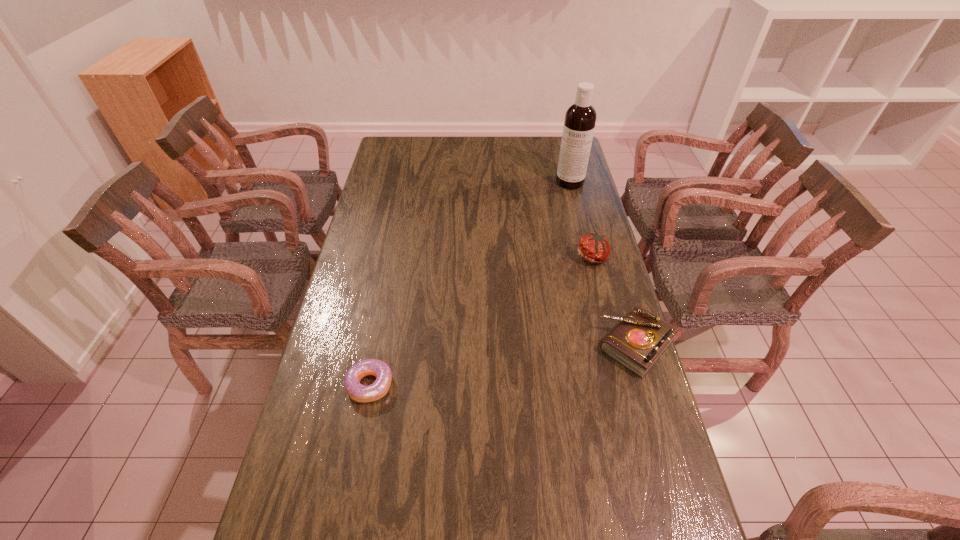
This screenshot has width=960, height=540. Identify the location of free space located 0.150m on the front-facing side of the third shortest object. (558, 289).

This screenshot has height=540, width=960. Find the location of `blank space located 0.300m on the front-facing side of the third shortest object`. blank space located 0.300m on the front-facing side of the third shortest object is located at coordinates (530, 315).

Identify the location of vacant space situated on the label side of the farthest object. Image resolution: width=960 pixels, height=540 pixels. (563, 214).

You are a GUI agent. You are given a task and a screenshot of the screen. Output one action in this format:
    pyautogui.click(x=<x>, y=<y>)
    Task: Click on the free space located on the label side of the farthest object
    
    Given the screenshot: What is the action you would take?
    pyautogui.click(x=565, y=201)

This screenshot has width=960, height=540. Identify the location of free spot located 0.340m on the label side of the farthest object. (557, 242).

Find the location of `object located at the left edge`. object located at the left edge is located at coordinates (356, 391).

This screenshot has height=540, width=960. Identify the location of diary located in the right edge section of the desktop. (639, 340).

The image size is (960, 540). Identify the location of tomato that is positioned at the right edge. (594, 248).

This screenshot has width=960, height=540. Find the location of `dishwasher detergent located at the right edge`. dishwasher detergent located at the right edge is located at coordinates (580, 118).

Find the location of a particular element. The image size is (960, 540). vacant space at the far edge of the desktop is located at coordinates (516, 141).